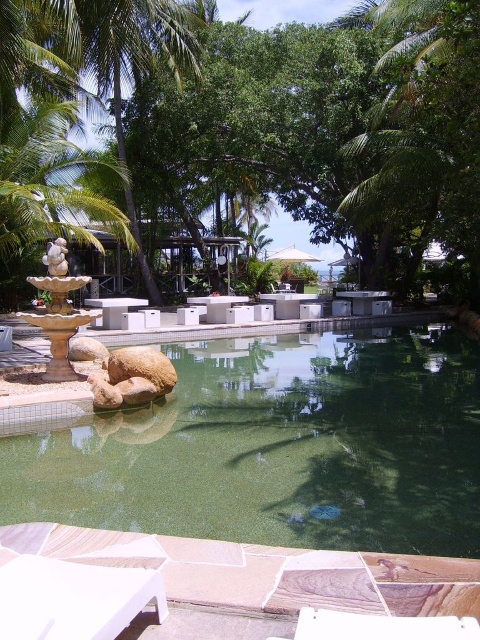
Question: From the image, what is the correct spatial relationship of green leafy tree at center in relation to green leafy palm tree at upper left?

Choices:
 (A) above
 (B) below

Answer: (B)

Question: Which of the following is the farthest from the observer?

Choices:
 (A) green leafy palm tree at upper left
 (B) green tile swimming pool at center

Answer: (A)

Question: Can you confirm if green leafy tree at center is positioned to the right of green tile swimming pool at center?

Choices:
 (A) yes
 (B) no

Answer: (A)

Question: Is green leafy tree at center smaller than green tile swimming pool at center?

Choices:
 (A) no
 (B) yes

Answer: (A)

Question: Which point is farther to the camera?

Choices:
 (A) (14, 19)
 (B) (56, 305)
 (C) (121, 33)
 (D) (442, 396)

Answer: (C)

Question: Considering the real-world distances, which object is farthest from the green tile swimming pool at center?

Choices:
 (A) green leafy tree at center
 (B) green leafy palm tree at upper left
 (C) stone fountain at center

Answer: (B)